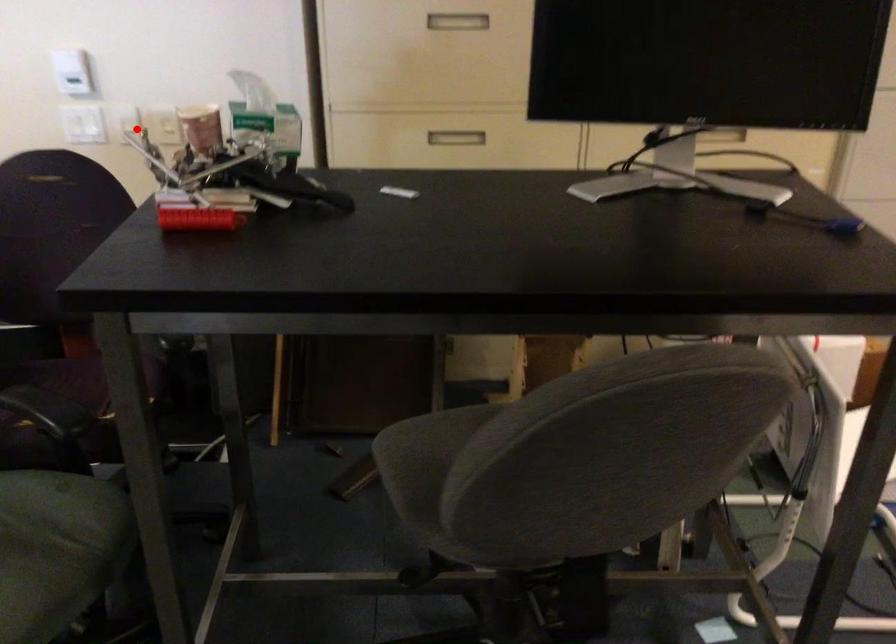
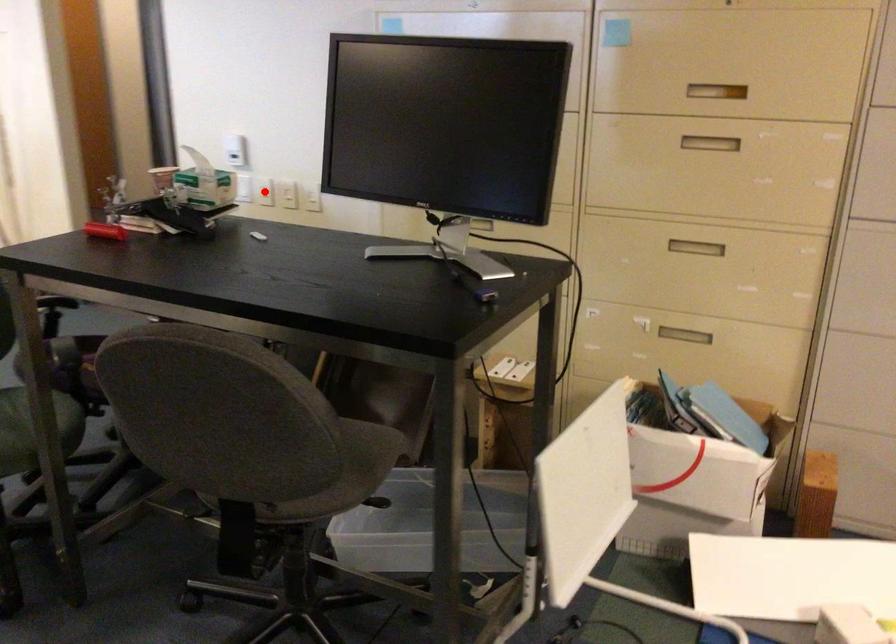
I am providing you with two images of the same scene from different viewpoints. A red point is marked on the first image and another point is marked on the second image. Are the points marked in image1 and image2 representing the same 3D position?

Yes